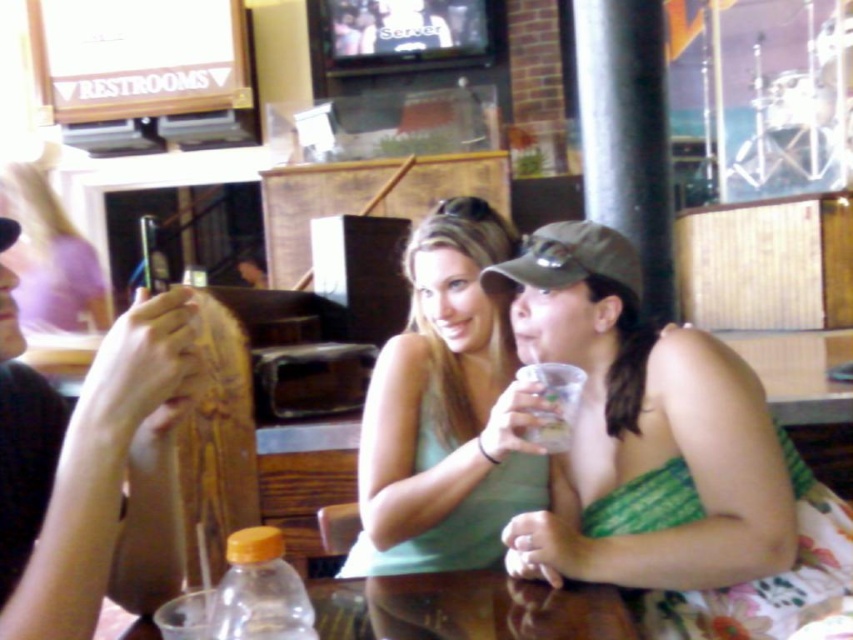
Does translucent plastic bottle at lower center have a smaller size compared to clear plastic cup at lower center?

Yes, translucent plastic bottle at lower center is smaller than clear plastic cup at lower center.

Is translucent plastic bottle at lower center above clear plastic cup at lower center?

No, translucent plastic bottle at lower center is not above clear plastic cup at lower center.

Describe the element at coordinates (260, 592) in the screenshot. I see `translucent plastic bottle at lower center` at that location.

Locate an element on the screen. translucent plastic bottle at lower center is located at coordinates (260, 592).

Can you confirm if green fabric dress at center is wider than translucent plastic bottle at lower center?

Yes.

In the scene shown: Who is positioned more to the left, green fabric dress at center or translucent plastic bottle at lower center?

translucent plastic bottle at lower center

Is point (717, 490) positioned behind point (247, 611)?

Yes, it is.

Identify the location of green fabric dress at center. The image size is (853, 640). (666, 458).

Is green matte tank top at center further to the viewer compared to brown wooden table at lower center?

That is True.

Which of these two, green matte tank top at center or brown wooden table at lower center, stands shorter?

brown wooden table at lower center is shorter.

Which is in front, point (444, 253) or point (360, 598)?

Point (360, 598)

This screenshot has width=853, height=640. I want to click on green matte tank top at center, so pyautogui.click(x=445, y=412).